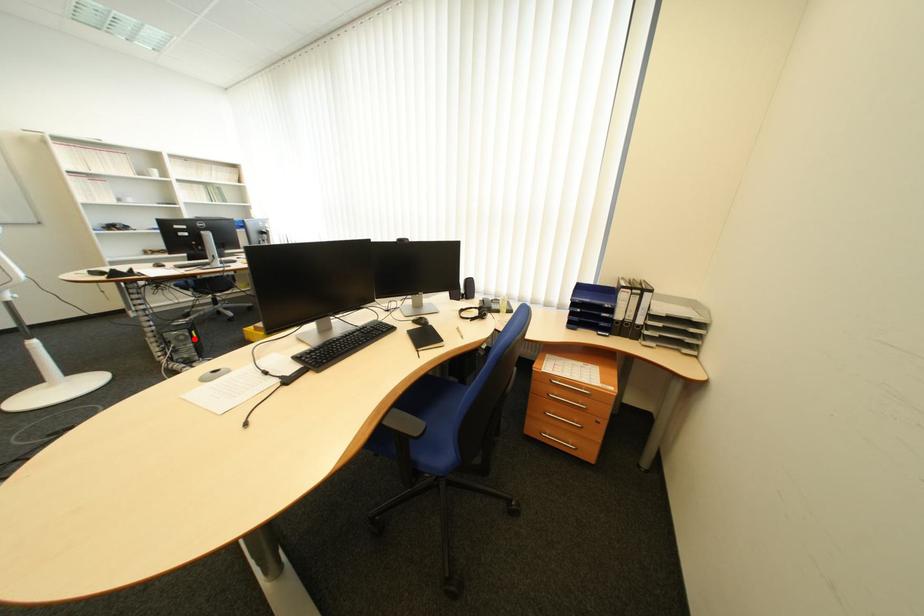
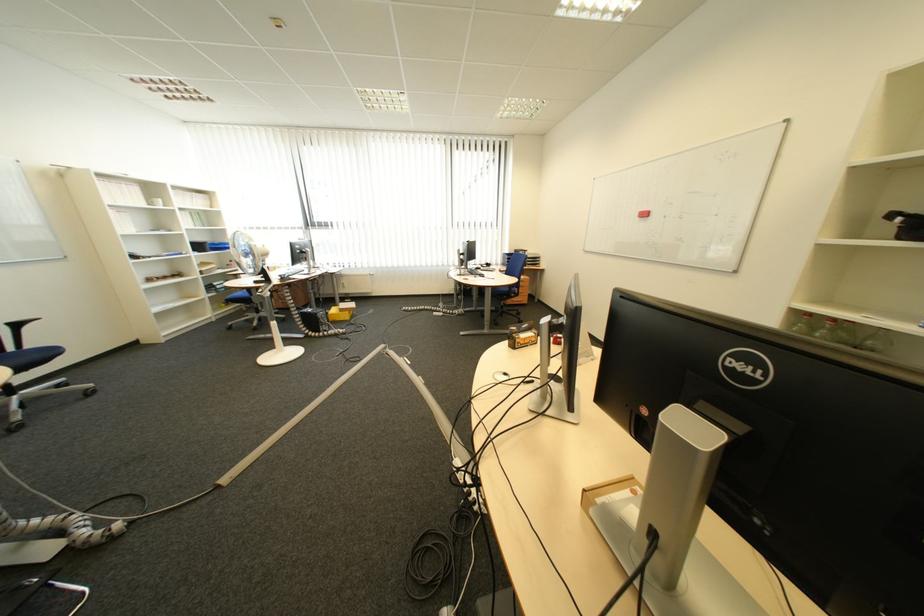
Question: I am providing you with two images of the same scene from different viewpoints. Image1 has a red point marked. In image2, the corresponding 3D location appears at what relative position? Reply with the corresponding letter.

Choices:
 (A) Closer
 (B) Farther

Answer: (A)